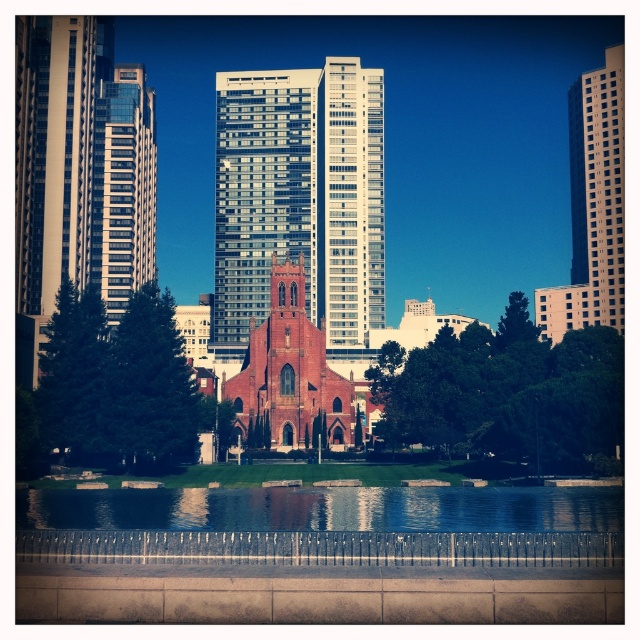
You are standing at the point marked as point (355, 124) in the cityscape. A friend is located 100 meters away from you in the direction of the red brick church. Can your friend see the church through the modern high rise buildings?

The distance between you and the viewer is 168.49 meters. Since your friend is 100 meters away from you towards the church, they are still 68.49 meters away from the church. The modern high rise buildings between the friend and the church may block the view. Without knowing the exact positions and heights of the buildings, it is impossible to determine if the friend can see the church.

You are a photographer planning to capture the reflection of the green leafy tree at center and the glassy reflective skyscraper at left in the water. Based on their positions, which object will have its reflection closer to the photographer?

The green leafy tree at center is below the glassy reflective skyscraper at left, so its reflection will be closer to the photographer.

You are standing at the center of the scene and want to take a photo that includes both the point at coordinates point (440, 392) and point (144, 266). Considering their positions, which point should you focus on to ensure both are in sharp focus?

To ensure both points are in sharp focus, you should focus on the point that is closer to the camera, which is point (440, 392). This is because focusing on the closer object maximizes the depth of field, making both points appear sharp.